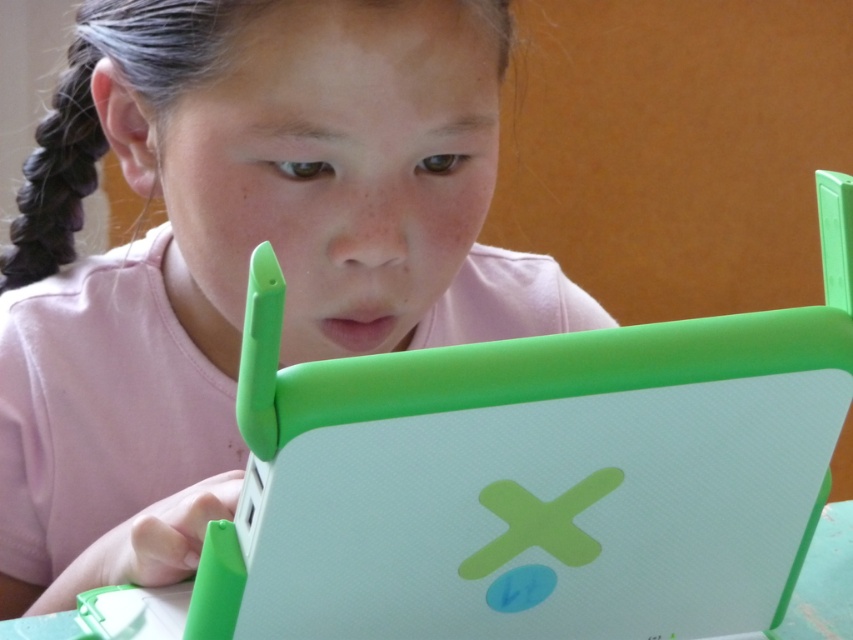
Question: Among these points, which one is nearest to the camera?

Choices:
 (A) (65, 627)
 (B) (583, 326)

Answer: (A)

Question: Where is pink matte shirt at center located in relation to white matte table at lower center in the image?

Choices:
 (A) right
 (B) left

Answer: (B)

Question: Which object appears closest to the camera in this image?

Choices:
 (A) white matte table at lower center
 (B) pink matte shirt at center

Answer: (B)

Question: Which point is farther from the camera taking this photo?

Choices:
 (A) (302, 13)
 (B) (793, 627)

Answer: (B)

Question: Does pink matte shirt at center have a greater width compared to white matte table at lower center?

Choices:
 (A) no
 (B) yes

Answer: (B)

Question: Is pink matte shirt at center bigger than white matte table at lower center?

Choices:
 (A) no
 (B) yes

Answer: (B)